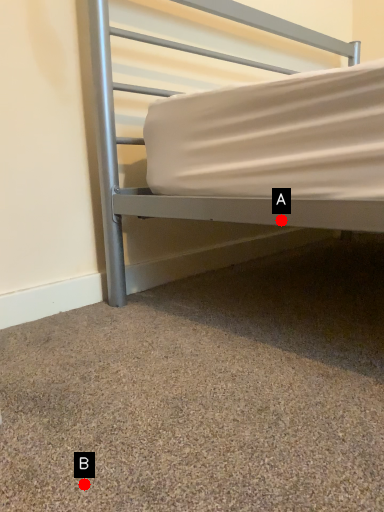
Question: Two points are circled on the image, labeled by A and B beside each circle. Among these points, which one is nearest to the camera?

Choices:
 (A) A is closer
 (B) B is closer

Answer: (B)